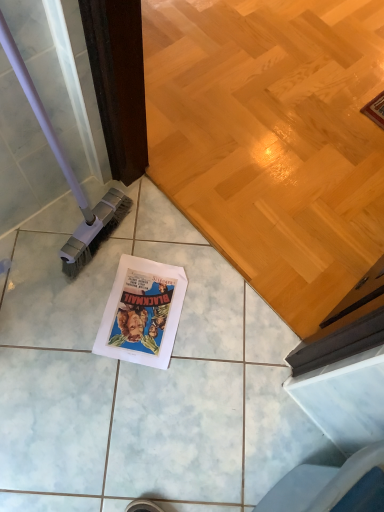
Question: Relative to white paper comic book at center, is purple plastic brush at left in front or behind?

Choices:
 (A) front
 (B) behind

Answer: (A)

Question: Would you say purple plastic brush at left is inside or outside white paper comic book at center?

Choices:
 (A) outside
 (B) inside

Answer: (A)

Question: From their relative heights in the image, would you say purple plastic brush at left is taller or shorter than white paper comic book at center?

Choices:
 (A) tall
 (B) short

Answer: (A)

Question: Considering the positions of white paper comic book at center and purple plastic brush at left in the image, is white paper comic book at center bigger or smaller than purple plastic brush at left?

Choices:
 (A) big
 (B) small

Answer: (B)

Question: Is white paper comic book at center wider or thinner than purple plastic brush at left?

Choices:
 (A) thin
 (B) wide

Answer: (B)

Question: Relative to purple plastic brush at left, is white paper comic book at center in front or behind?

Choices:
 (A) behind
 (B) front

Answer: (A)

Question: Is white paper comic book at center to the left or to the right of purple plastic brush at left in the image?

Choices:
 (A) left
 (B) right

Answer: (B)